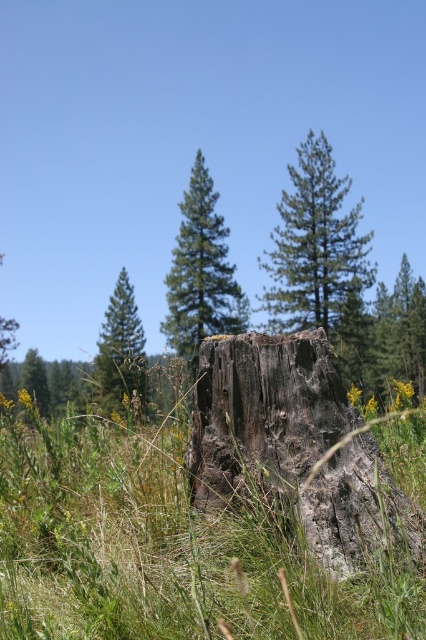
Question: Is green grass at center smaller than green needle-like tree at upper center?

Choices:
 (A) yes
 (B) no

Answer: (A)

Question: In this image, where is dark brown rough tree stump at center located relative to green rough tree stump at left?

Choices:
 (A) right
 (B) left

Answer: (A)

Question: Which of these objects is positioned closest to the dark brown rough tree stump at center?

Choices:
 (A) green rough tree stump at left
 (B) green rough bark tree at upper left
 (C) green rough bark tree at center
 (D) green needle-like tree at upper center

Answer: (B)

Question: Which point appears farthest from the camera in this image?

Choices:
 (A) (319, 204)
 (B) (108, 305)
 (C) (43, 380)

Answer: (C)

Question: Does dark brown rough tree stump at center appear under green rough bark tree at center?

Choices:
 (A) yes
 (B) no

Answer: (A)

Question: Which point appears closest to the camera in this image?

Choices:
 (A) (40, 406)
 (B) (115, 390)

Answer: (B)